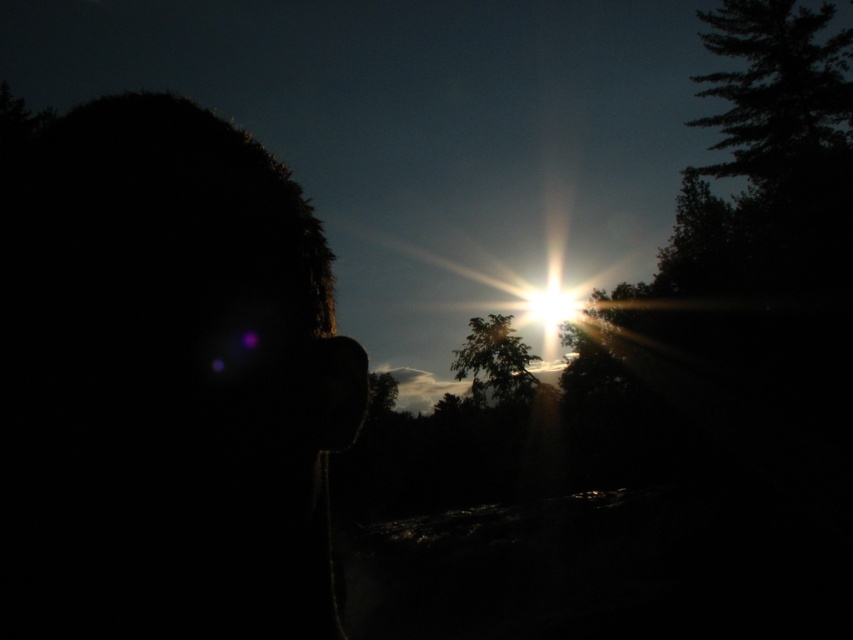
Question: Which point appears farthest from the camera in this image?

Choices:
 (A) (549, 294)
 (B) (459, 374)
 (C) (206, 333)

Answer: (A)

Question: Which point is closer to the camera?

Choices:
 (A) silhouette head at left
 (B) green leafy tree at center
 (C) bright sun at center

Answer: (A)

Question: Does silhouette head at left appear on the left side of green leafy tree at center?

Choices:
 (A) yes
 (B) no

Answer: (A)

Question: Which object is the farthest from the silhouette head at left?

Choices:
 (A) bright sun at center
 (B) green leafy tree at center

Answer: (A)

Question: Does green leafy tree at center appear on the left side of bright sun at center?

Choices:
 (A) no
 (B) yes

Answer: (B)

Question: Does silhouette head at left lie behind green leafy tree at center?

Choices:
 (A) no
 (B) yes

Answer: (A)